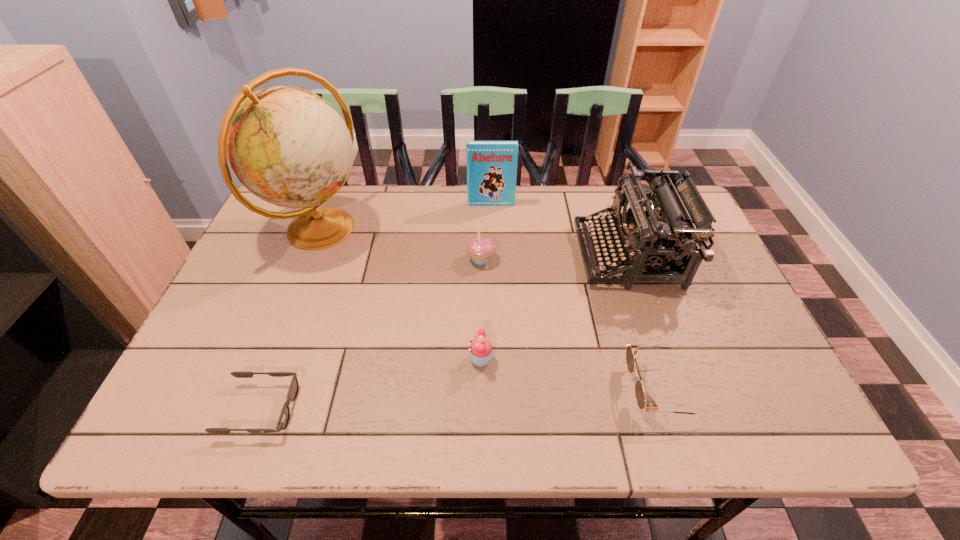
This screenshot has height=540, width=960. I want to click on free spot between the typewriter and the right sunglasses, so click(x=644, y=322).

Locate an element on the screen. vacant point located between the shorter cupcake and the typewriter is located at coordinates (555, 307).

This screenshot has width=960, height=540. What are the coordinates of `free space between the book and the typewriter` in the screenshot? It's located at (560, 230).

Find the location of `vacant area that lies between the typewriter and the shorter cupcake`. vacant area that lies between the typewriter and the shorter cupcake is located at coordinates (555, 307).

Find the location of `vacant space in between the book and the typewriter`. vacant space in between the book and the typewriter is located at coordinates (560, 230).

Select which object is the second closest to the nearer cupcake. Please provide its 2D coordinates. Your answer should be formatted as a tuple, i.e. [(x, y)], where the tuple contains the x and y coordinates of a point satisfying the conditions above.

[(651, 238)]

Locate an element on the screen. object that is the second closest to the shortest object is located at coordinates (288, 146).

Locate an element on the screen. free space that satisfies the following two spatial constraints: 1. on the front cover of the book; 2. on the face of the nearer cupcake is located at coordinates (495, 359).

Find the location of `vacant area that satisfies the following two spatial constraints: 1. on the front cover of the book; 2. on the temples of the shortest object`. vacant area that satisfies the following two spatial constraints: 1. on the front cover of the book; 2. on the temples of the shortest object is located at coordinates (497, 409).